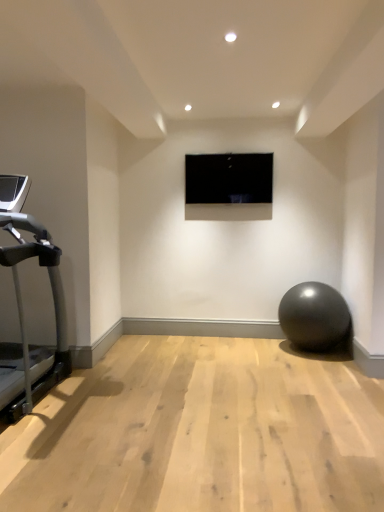
Question: Is black glossy screen at center turned away from matte gray ball at lower right?

Choices:
 (A) no
 (B) yes

Answer: (A)

Question: Is black glossy screen at center smaller than matte gray ball at lower right?

Choices:
 (A) no
 (B) yes

Answer: (B)

Question: Would you consider black glossy screen at center to be distant from matte gray ball at lower right?

Choices:
 (A) no
 (B) yes

Answer: (B)

Question: Can you confirm if black glossy screen at center is wider than matte gray ball at lower right?

Choices:
 (A) yes
 (B) no

Answer: (B)

Question: Is black glossy screen at center at the right side of matte gray ball at lower right?

Choices:
 (A) yes
 (B) no

Answer: (B)

Question: From a real-world perspective, is black glossy screen at center physically below matte gray ball at lower right?

Choices:
 (A) yes
 (B) no

Answer: (B)

Question: From the image's perspective, is silver metallic treadmill at left above matte gray ball at lower right?

Choices:
 (A) no
 (B) yes

Answer: (B)

Question: Is silver metallic treadmill at left facing towards matte gray ball at lower right?

Choices:
 (A) yes
 (B) no

Answer: (B)

Question: Is silver metallic treadmill at left to the left of matte gray ball at lower right from the viewer's perspective?

Choices:
 (A) yes
 (B) no

Answer: (A)

Question: Is silver metallic treadmill at left not inside matte gray ball at lower right?

Choices:
 (A) yes
 (B) no

Answer: (A)

Question: Is silver metallic treadmill at left wider than matte gray ball at lower right?

Choices:
 (A) no
 (B) yes

Answer: (B)

Question: Are silver metallic treadmill at left and matte gray ball at lower right far apart?

Choices:
 (A) no
 (B) yes

Answer: (B)

Question: Does silver metallic treadmill at left have a smaller size compared to black glossy screen at center?

Choices:
 (A) no
 (B) yes

Answer: (A)